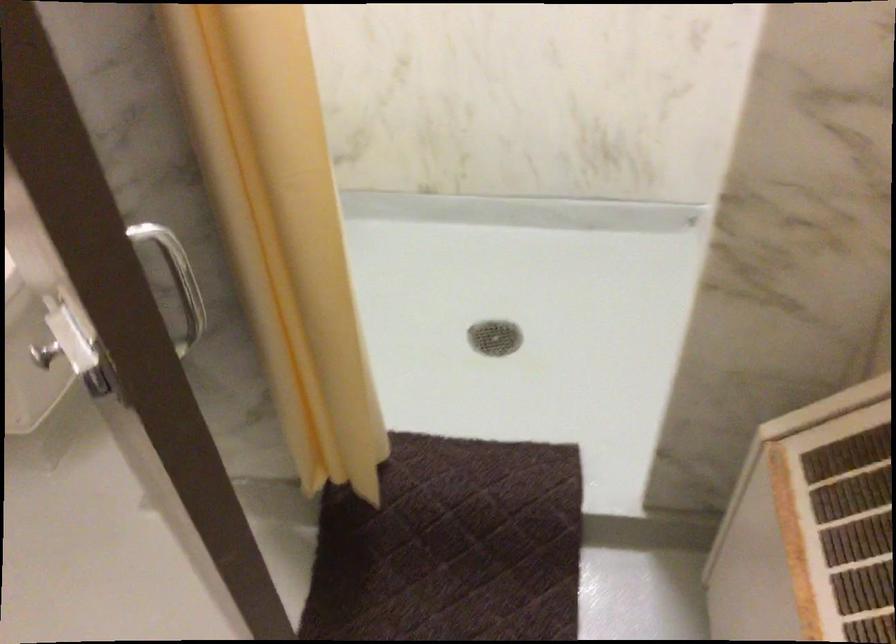
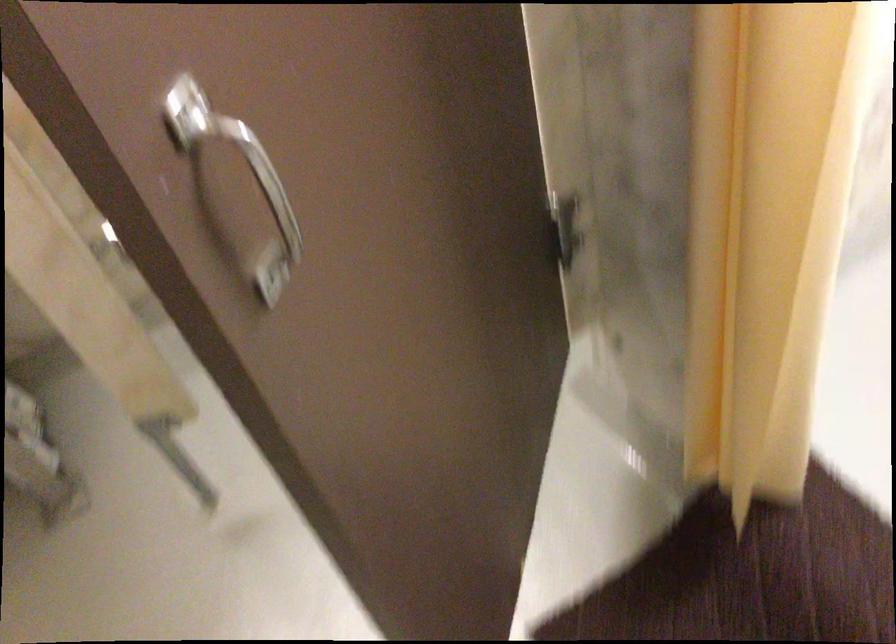
How did the camera likely rotate?

The camera rotated toward left-down.